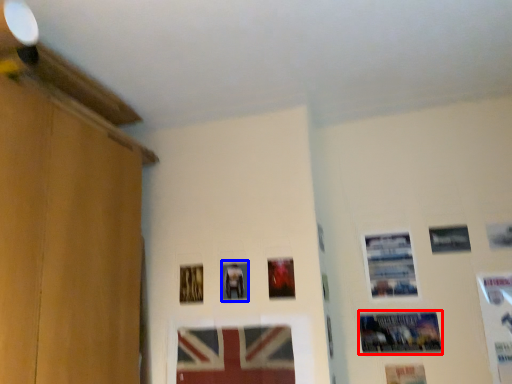
Question: Which of the following is the farthest to the observer, picture frame (highlighted by a red box) or picture frame (highlighted by a blue box)?

Choices:
 (A) picture frame
 (B) picture frame

Answer: (B)